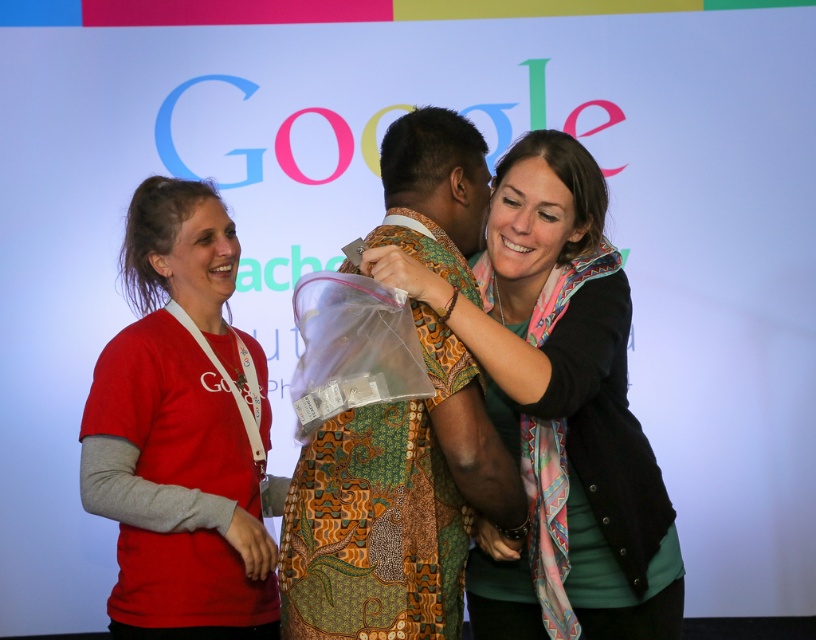
Is the position of multicolored scarf at center more distant than that of batik-patterned shirt at center?

Yes, multicolored scarf at center is further from the viewer.

What do you see at coordinates (561, 410) in the screenshot? This screenshot has height=640, width=816. I see `multicolored scarf at center` at bounding box center [561, 410].

The image size is (816, 640). Identify the location of multicolored scarf at center. (561, 410).

Is point (540, 404) closer to camera compared to point (220, 304)?

Yes, point (540, 404) is closer to viewer.

Who is more distant from viewer, (x=540, y=429) or (x=242, y=547)?

Point (x=242, y=547)

Locate an element on the screen. The image size is (816, 640). multicolored scarf at center is located at coordinates (561, 410).

From the picture: Can you confirm if batik-patterned shirt at center is bigger than red cotton t-shirt at left?

Actually, batik-patterned shirt at center might be smaller than red cotton t-shirt at left.

Is batik-patterned shirt at center closer to camera compared to red cotton t-shirt at left?

Yes, it is.

Does point (448, 417) lie behind point (202, 614)?

No.

The height and width of the screenshot is (640, 816). Identify the location of batik-patterned shirt at center. (395, 506).